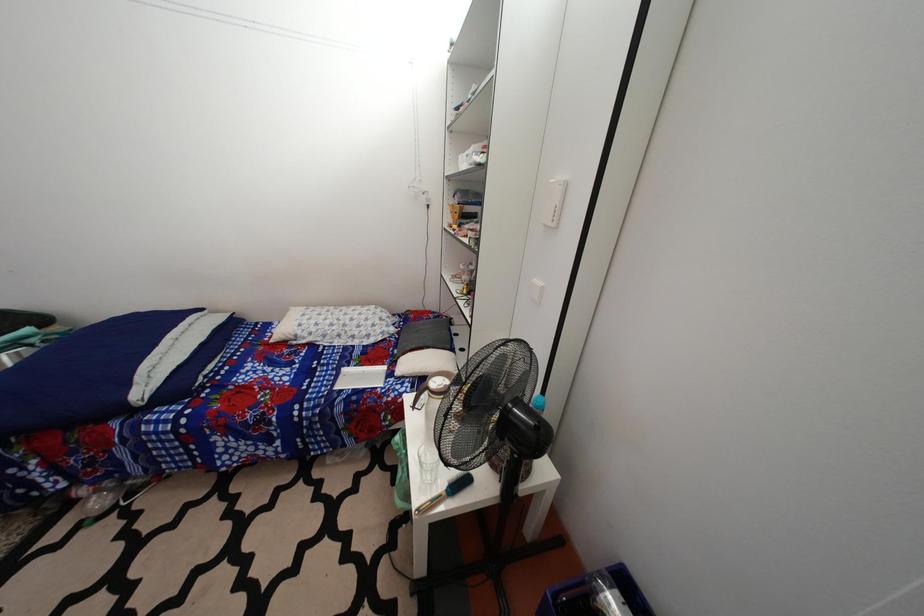
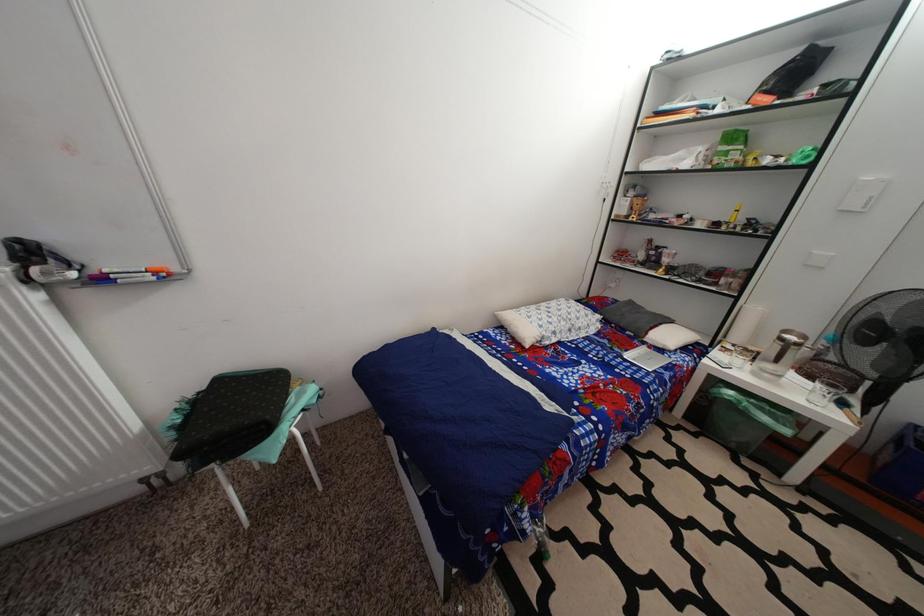
Question: Which direction would the cameraman need to move to produce the second image? Reply with the corresponding letter.

Choices:
 (A) Left
 (B) Right
 (C) Forward
 (D) Backward

Answer: (A)